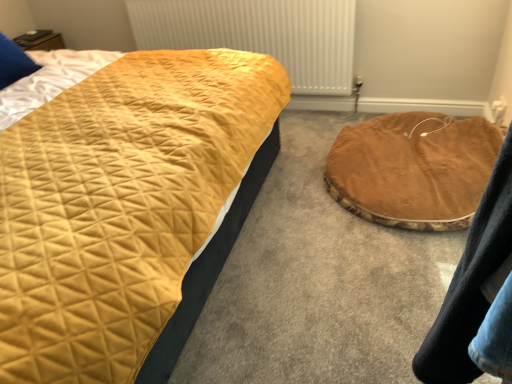
Question: Is metallic white radiator at upper center wider than brown velvety cat bed at lower right?

Choices:
 (A) no
 (B) yes

Answer: (A)

Question: Can you confirm if metallic white radiator at upper center is thinner than brown velvety cat bed at lower right?

Choices:
 (A) yes
 (B) no

Answer: (A)

Question: Considering the relative sizes of metallic white radiator at upper center and brown velvety cat bed at lower right in the image provided, is metallic white radiator at upper center smaller than brown velvety cat bed at lower right?

Choices:
 (A) yes
 (B) no

Answer: (A)

Question: Is metallic white radiator at upper center completely or partially outside of brown velvety cat bed at lower right?

Choices:
 (A) yes
 (B) no

Answer: (A)

Question: Is metallic white radiator at upper center far away from brown velvety cat bed at lower right?

Choices:
 (A) yes
 (B) no

Answer: (B)

Question: Is point (208, 36) closer or farther from the camera than point (422, 195)?

Choices:
 (A) closer
 (B) farther

Answer: (B)

Question: From the image's perspective, is metallic white radiator at upper center positioned above or below brown velvety cat bed at lower right?

Choices:
 (A) below
 (B) above

Answer: (B)

Question: Considering the positions of metallic white radiator at upper center and brown velvety cat bed at lower right in the image, is metallic white radiator at upper center bigger or smaller than brown velvety cat bed at lower right?

Choices:
 (A) small
 (B) big

Answer: (A)

Question: In terms of width, does metallic white radiator at upper center look wider or thinner when compared to brown velvety cat bed at lower right?

Choices:
 (A) thin
 (B) wide

Answer: (A)

Question: Which is correct: brown velvety cat bed at lower right is inside brown plush pet bed at center, or outside of it?

Choices:
 (A) outside
 (B) inside

Answer: (A)

Question: Considering their positions, is brown velvety cat bed at lower right located in front of or behind brown plush pet bed at center?

Choices:
 (A) front
 (B) behind

Answer: (B)

Question: Considering the positions of point (421, 196) and point (494, 192), is point (421, 196) closer or farther from the camera than point (494, 192)?

Choices:
 (A) closer
 (B) farther

Answer: (B)

Question: From the image's perspective, is brown velvety cat bed at lower right located above or below brown plush pet bed at center?

Choices:
 (A) below
 (B) above

Answer: (B)

Question: Considering their positions, is brown plush pet bed at center located in front of or behind metallic white radiator at upper center?

Choices:
 (A) behind
 (B) front

Answer: (B)

Question: Would you say brown plush pet bed at center is to the left or to the right of metallic white radiator at upper center in the picture?

Choices:
 (A) right
 (B) left

Answer: (A)